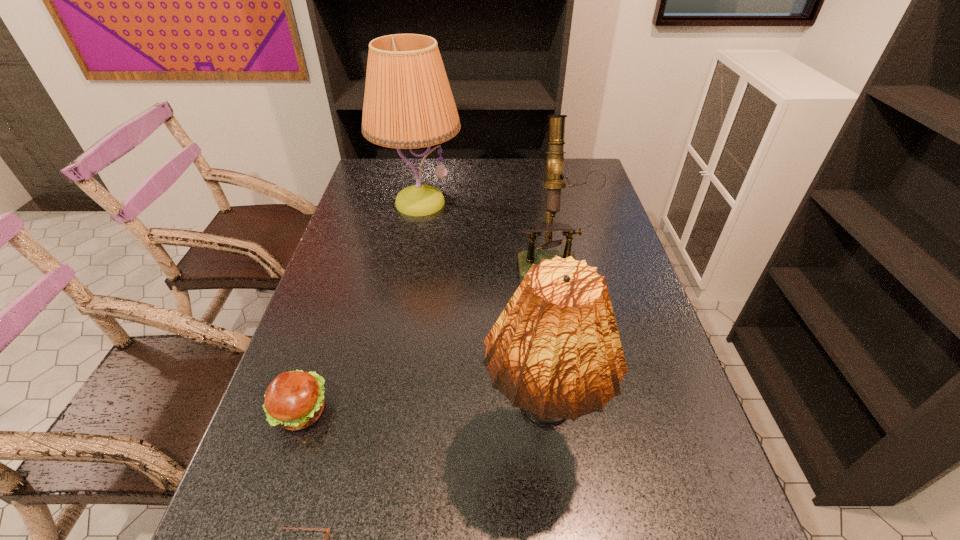
Where is `object that is at the right edge`? object that is at the right edge is located at coordinates (596, 179).

At what (x,y) coordinates should I click in order to perform the action: click on object that is at the far left corner. Please return your answer as a coordinate pair (x, y). The image size is (960, 540). Looking at the image, I should click on (408, 103).

This screenshot has width=960, height=540. I want to click on vacant space at the far edge, so click(x=474, y=181).

This screenshot has height=540, width=960. In order to click on free space at the left edge of the desktop in this screenshot , I will do `click(362, 290)`.

Find the location of a particular element. Image resolution: width=960 pixels, height=540 pixels. free location at the right edge of the desktop is located at coordinates (612, 265).

Where is `free space at the far left corner of the desktop`? free space at the far left corner of the desktop is located at coordinates (372, 178).

Where is `vacant region at the far right corner`? vacant region at the far right corner is located at coordinates (588, 189).

Where is `vacant area that lies between the lamp and the hamburger`? vacant area that lies between the lamp and the hamburger is located at coordinates [360, 307].

Image resolution: width=960 pixels, height=540 pixels. Identify the location of vacant space in between the hamburger and the second farthest object. (426, 335).

Find the location of `free space between the lamp and the lampshade`. free space between the lamp and the lampshade is located at coordinates (478, 319).